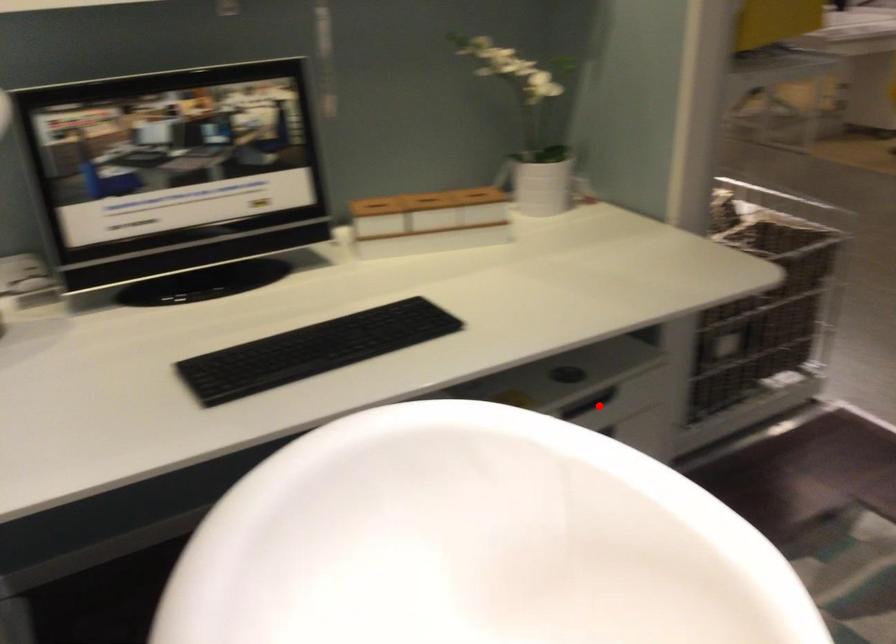
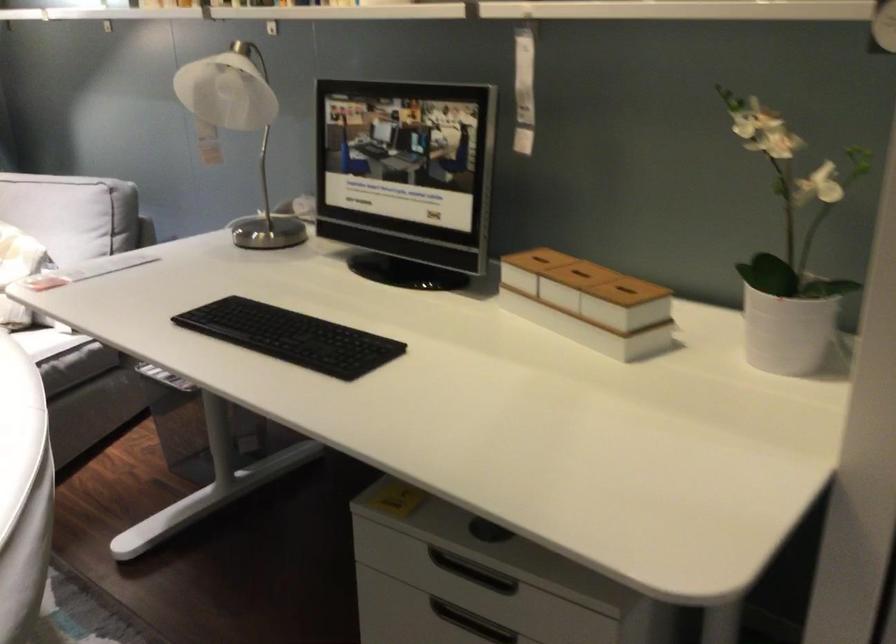
The point at the highlighted location is marked in the first image. Where is the corresponding point in the second image?

(471, 571)